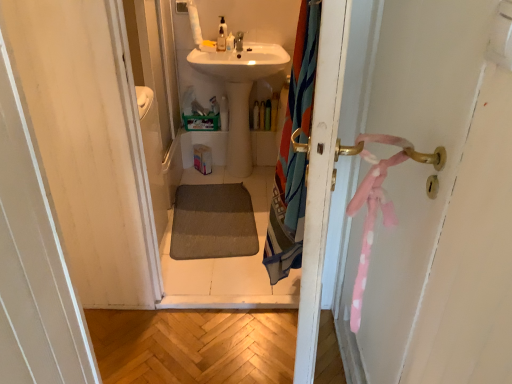
Question: Is translucent plastic soap dispenser at upper center, which is counted as the 2th toiletry, starting from the left, positioned with its back to white glossy sink at center?

Choices:
 (A) no
 (B) yes

Answer: (A)

Question: Considering the relative sizes of translucent plastic soap dispenser at upper center, which is counted as the 2th toiletry, starting from the left, and white glossy sink at center in the image provided, is translucent plastic soap dispenser at upper center, which is counted as the 2th toiletry, starting from the left, shorter than white glossy sink at center?

Choices:
 (A) yes
 (B) no

Answer: (A)

Question: Can you confirm if translucent plastic soap dispenser at upper center, which is counted as the 3th toiletry, starting from the right, is bigger than white glossy sink at center?

Choices:
 (A) yes
 (B) no

Answer: (B)

Question: From the image's perspective, does translucent plastic soap dispenser at upper center, arranged as the 2th toiletry when viewed from the front, appear higher than white glossy sink at center?

Choices:
 (A) yes
 (B) no

Answer: (A)

Question: Is translucent plastic soap dispenser at upper center, which is counted as the fourth toiletry, starting from the bottom, positioned in front of white glossy sink at center?

Choices:
 (A) yes
 (B) no

Answer: (B)

Question: From a real-world perspective, is translucent plastic soap dispenser at upper center, which is the first toiletry from left to right, above or below multicolored fabric shower curtain at right?

Choices:
 (A) above
 (B) below

Answer: (A)

Question: Considering the positions of translucent plastic soap dispenser at upper center, the 4th toiletry positioned from the back, and multicolored fabric shower curtain at right in the image, is translucent plastic soap dispenser at upper center, the 4th toiletry positioned from the back, taller or shorter than multicolored fabric shower curtain at right?

Choices:
 (A) tall
 (B) short

Answer: (B)

Question: Is point (221, 33) positioned closer to the camera than point (323, 168)?

Choices:
 (A) closer
 (B) farther

Answer: (B)

Question: Would you say translucent plastic soap dispenser at upper center, which appears as the third toiletry when ordered from the bottom, is to the left or to the right of multicolored fabric shower curtain at right in the picture?

Choices:
 (A) left
 (B) right

Answer: (A)

Question: Looking at their shapes, would you say multicolored fabric shower curtain at right is wider or thinner than translucent plastic bottle at center, the second toiletry positioned from the right?

Choices:
 (A) thin
 (B) wide

Answer: (A)

Question: From a real-world perspective, is multicolored fabric shower curtain at right physically located above or below translucent plastic bottle at center, the second toiletry positioned from the right?

Choices:
 (A) below
 (B) above

Answer: (B)

Question: Is multicolored fabric shower curtain at right spatially inside translucent plastic bottle at center, acting as the fourth toiletry starting from the top, or outside of it?

Choices:
 (A) outside
 (B) inside

Answer: (A)

Question: In terms of height, does multicolored fabric shower curtain at right look taller or shorter compared to translucent plastic bottle at center, acting as the fourth toiletry starting from the top?

Choices:
 (A) short
 (B) tall

Answer: (B)

Question: Based on their sizes in the image, would you say translucent plastic soap dispenser at upper center, the third toiletry in the back-to-front sequence, is bigger or smaller than white glossy sink at center?

Choices:
 (A) small
 (B) big

Answer: (A)

Question: From the image's perspective, is translucent plastic soap dispenser at upper center, which is counted as the 2th toiletry, starting from the left, positioned above or below white glossy sink at center?

Choices:
 (A) below
 (B) above

Answer: (B)